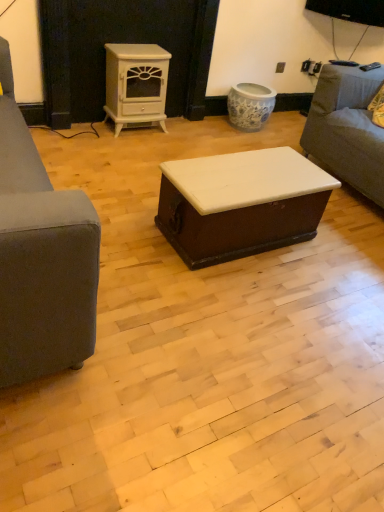
Question: Considering the relative positions of white glossy wood stove at upper center and gray fabric couch at right in the image provided, is white glossy wood stove at upper center in front of gray fabric couch at right?

Choices:
 (A) no
 (B) yes

Answer: (A)

Question: Can you confirm if white glossy wood stove at upper center is wider than gray fabric couch at right?

Choices:
 (A) yes
 (B) no

Answer: (B)

Question: From a real-world perspective, is white glossy wood stove at upper center physically below gray fabric couch at right?

Choices:
 (A) no
 (B) yes

Answer: (B)

Question: From a real-world perspective, is white glossy wood stove at upper center on gray fabric couch at right?

Choices:
 (A) no
 (B) yes

Answer: (A)

Question: From the image's perspective, does white glossy wood stove at upper center appear higher than gray fabric couch at right?

Choices:
 (A) yes
 (B) no

Answer: (A)

Question: Considering their positions, is white glossy wood stove at upper center located in front of or behind gray fabric couch at right?

Choices:
 (A) front
 (B) behind

Answer: (B)

Question: In terms of height, does white glossy wood stove at upper center look taller or shorter compared to gray fabric couch at right?

Choices:
 (A) short
 (B) tall

Answer: (A)

Question: Considering the positions of white glossy wood stove at upper center and gray fabric couch at right in the image, is white glossy wood stove at upper center bigger or smaller than gray fabric couch at right?

Choices:
 (A) big
 (B) small

Answer: (B)

Question: From the image's perspective, is white glossy wood stove at upper center above or below gray fabric couch at right?

Choices:
 (A) below
 (B) above

Answer: (B)

Question: Looking at the image, does white glossy trunk at center seem bigger or smaller compared to white glossy wood stove at upper center?

Choices:
 (A) small
 (B) big

Answer: (B)

Question: Is white glossy trunk at center taller or shorter than white glossy wood stove at upper center?

Choices:
 (A) tall
 (B) short

Answer: (B)

Question: From the image's perspective, is white glossy trunk at center positioned above or below white glossy wood stove at upper center?

Choices:
 (A) below
 (B) above

Answer: (A)

Question: Considering the positions of white glossy trunk at center and white glossy wood stove at upper center in the image, is white glossy trunk at center wider or thinner than white glossy wood stove at upper center?

Choices:
 (A) thin
 (B) wide

Answer: (B)

Question: In terms of width, does white glossy trunk at center look wider or thinner when compared to gray fabric couch at right?

Choices:
 (A) wide
 (B) thin

Answer: (B)

Question: From the image's perspective, relative to gray fabric couch at right, is white glossy trunk at center above or below?

Choices:
 (A) below
 (B) above

Answer: (A)